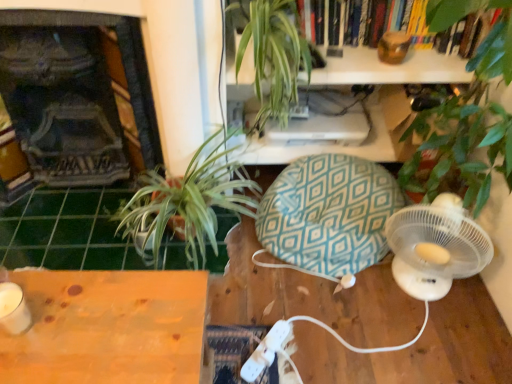
I want to click on free area in between white plastic fan at lower right and white plastic wii controller at lower center, so click(343, 326).